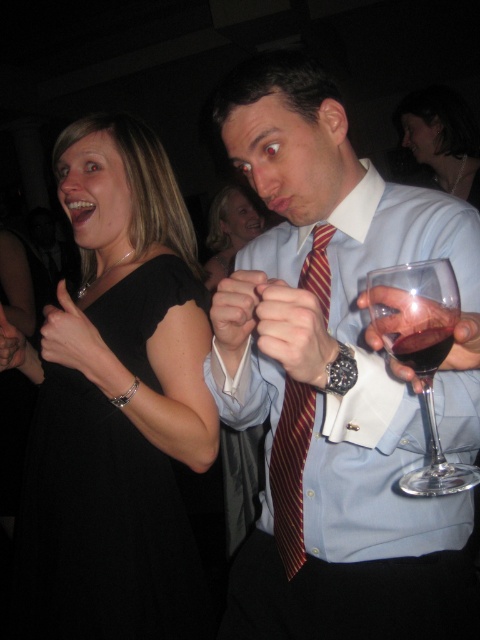
Question: Is matte black dress at center to the right of dark red liquid at center right from the viewer's perspective?

Choices:
 (A) no
 (B) yes

Answer: (B)

Question: Which point is closer to the camera taking this photo?

Choices:
 (A) (24, 611)
 (B) (216, 212)
 (C) (432, 323)

Answer: (C)

Question: Observing the image, what is the correct spatial positioning of black satin dress at left in reference to maroon striped tie at center?

Choices:
 (A) right
 (B) left

Answer: (B)

Question: Which of these objects is positioned farthest from the maroon striped tie at center?

Choices:
 (A) matte black dress at center
 (B) black satin dress at left
 (C) black satin dress at upper left

Answer: (A)

Question: Which point is farther from the camera taking this photo?

Choices:
 (A) (422, 364)
 (B) (303, 276)
 (C) (288, 538)
 (D) (147, 621)

Answer: (D)

Question: Observing the image, what is the correct spatial positioning of transparent glass at right in reference to maroon striped tie at center?

Choices:
 (A) right
 (B) left

Answer: (A)